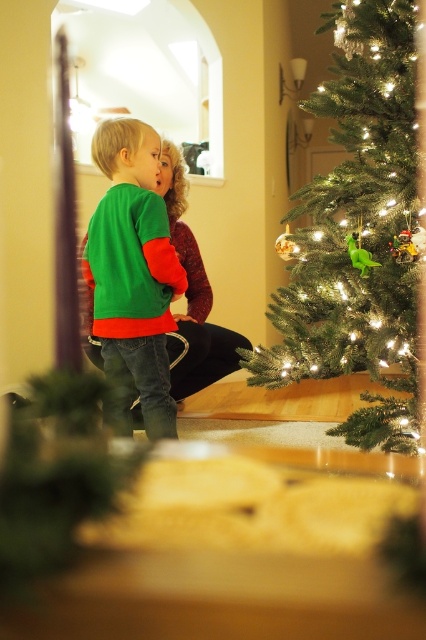
Does green matte christmas tree at right come in front of green matte sweater at center?

Yes, it is.

You are a GUI agent. You are given a task and a screenshot of the screen. Output one action in this format:
    pyautogui.click(x=<x>, y=<y>)
    Task: Click on the green matte christmas tree at right
    This screenshot has width=426, height=640.
    Given the screenshot: What is the action you would take?
    pyautogui.click(x=362, y=236)